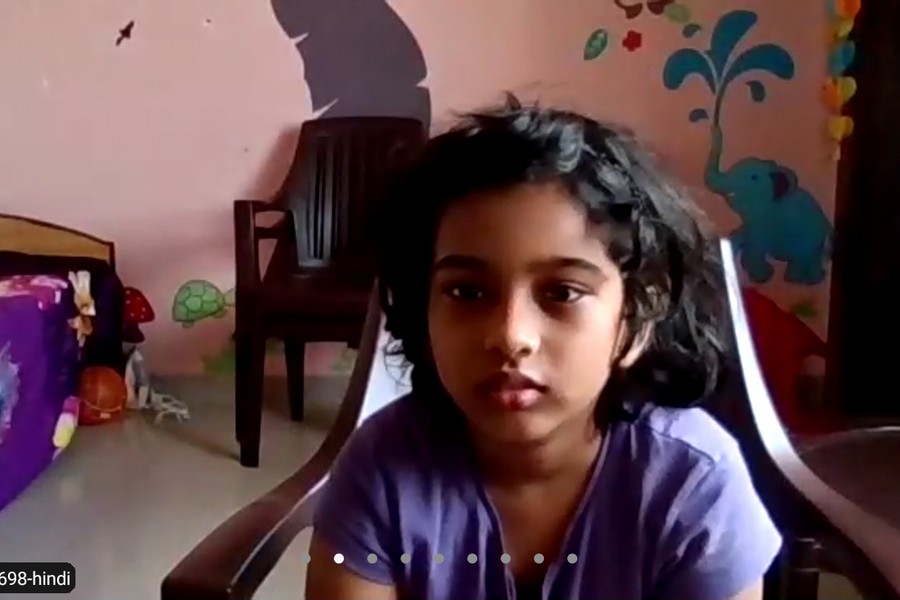
Identify the location of reflected white light on chair. (756, 399), (381, 394).